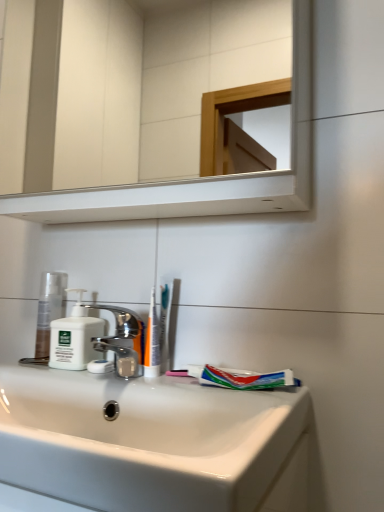
Identify the location of blank area to the left of multicolored plastic toothpaste at lower center. (148, 382).